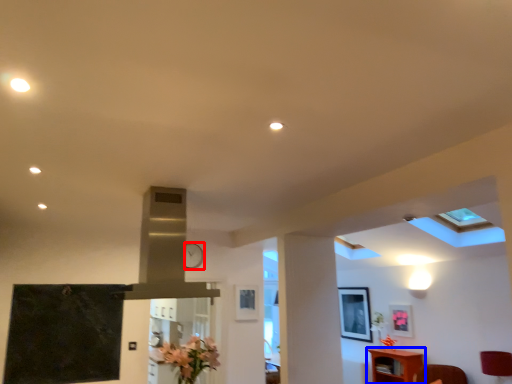
Question: Which of the following is the farthest to the observer, clock (highlighted by a red box) or furniture (highlighted by a blue box)?

Choices:
 (A) clock
 (B) furniture

Answer: (B)